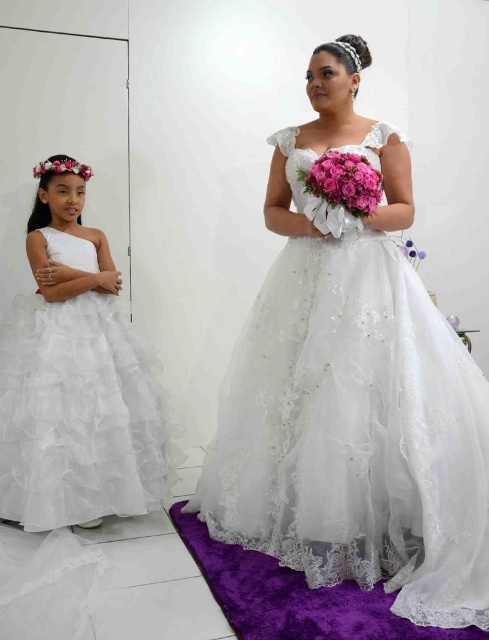
You are a photographer taking a picture of the two people in the scene. You notice two points marked in the image. The first point is at coordinate point (373,209) and the second is at point (63,163). Which point will appear larger in your photo?

Point (373,209) is closer to the camera than point (63,163), so it will appear larger in the photo.

You are a photographer at a wedding and need to capture a shot where the pink satin bouquet at center and the floral crown at upper left are both visible. Based on their positions, will the bouquet block the view of the floral crown?

The pink satin bouquet at center is below the floral crown at upper left, so the bouquet will not block the view of the floral crown.